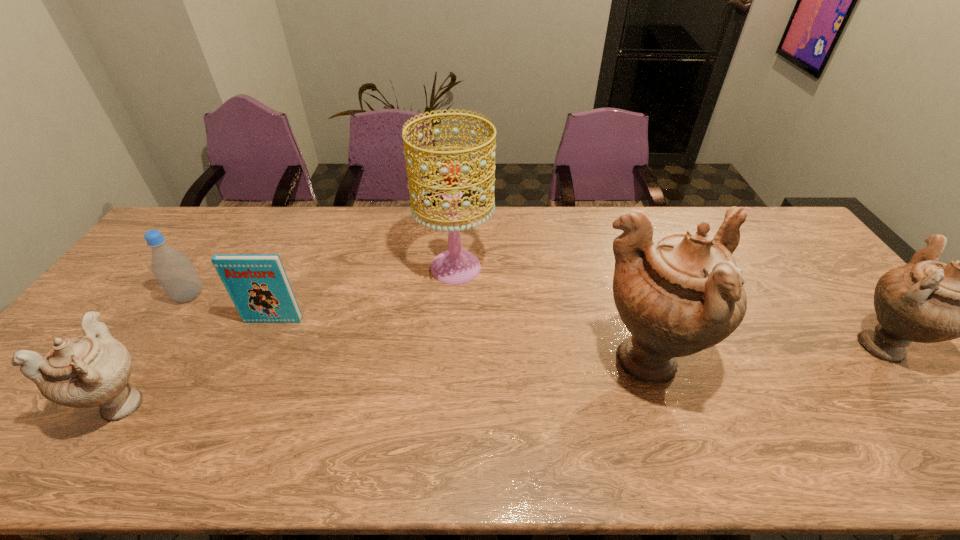
At what (x,y) coordinates should I click in order to perform the action: click on the shortest urn. Please return your answer as a coordinate pair (x, y). The height and width of the screenshot is (540, 960). Looking at the image, I should click on (89, 370).

The width and height of the screenshot is (960, 540). What are the coordinates of `the fifth object from left to right` in the screenshot? It's located at (678, 294).

The image size is (960, 540). In order to click on the second urn from left to right in this screenshot , I will do click(x=678, y=294).

Find the location of a particular element. The image size is (960, 540). the rightmost urn is located at coordinates (926, 301).

At what (x,y) coordinates should I click in order to perform the action: click on the third tallest object. Please return your answer as a coordinate pair (x, y). This screenshot has height=540, width=960. Looking at the image, I should click on (926, 301).

Find the location of a particular element. The height and width of the screenshot is (540, 960). bottle is located at coordinates (174, 271).

The image size is (960, 540). In order to click on the third object from left to right in this screenshot , I will do `click(258, 285)`.

Identify the location of lampshade. (455, 266).

Image resolution: width=960 pixels, height=540 pixels. In order to click on free space located 0.360m on the right of the leftmost urn in this screenshot , I will do click(x=309, y=403).

The height and width of the screenshot is (540, 960). In order to click on free space located 0.350m on the left of the second urn from right to left in this screenshot , I will do `click(453, 362)`.